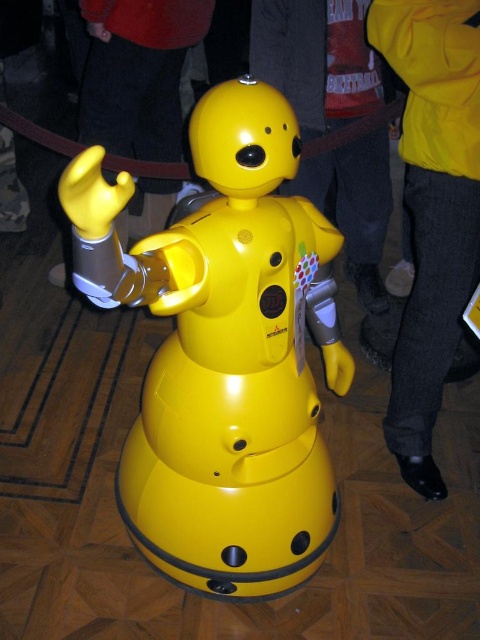
You are standing in a room with two robots. The matte plastic robot at center and the yellow matte robot at center. Which one is positioned to the left?

The matte plastic robot at center is positioned to the left of the yellow matte robot at center.

You are a visitor in a museum and see two robots displayed in the center of the room. The yellow matte robot at center and the matte yellow robot at center. Which one is positioned lower in the room?

The yellow matte robot at center is positioned lower than the matte yellow robot at center.